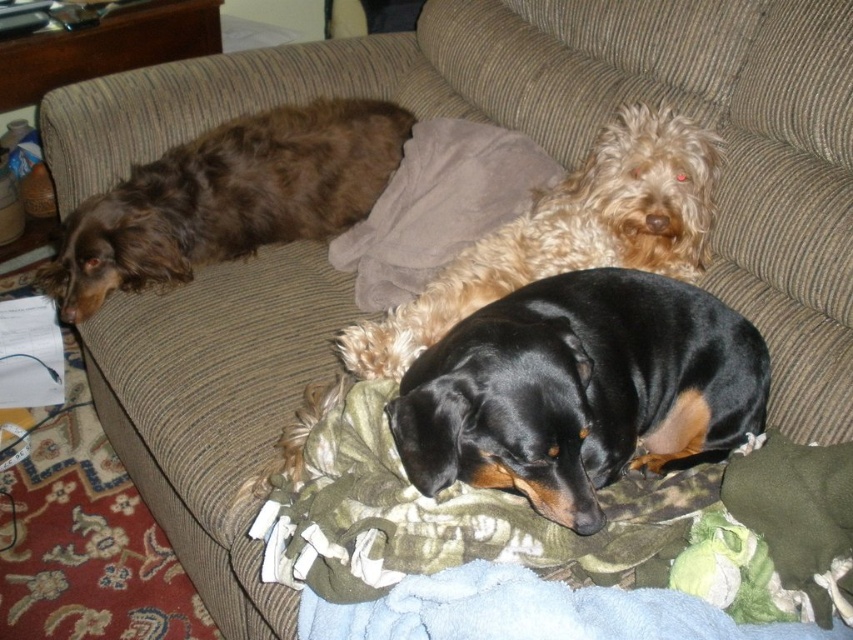
You are a photographer trying to capture a closeup of the brown shaggy dog at left without moving the camouflage fabric blanket at lower center. Is the blanket in the way of the camera view towards the dog?

The camouflage fabric blanket at lower center is not as tall as the brown shaggy dog at left, so the blanket is lower and likely not blocking the camera view towards the dog.